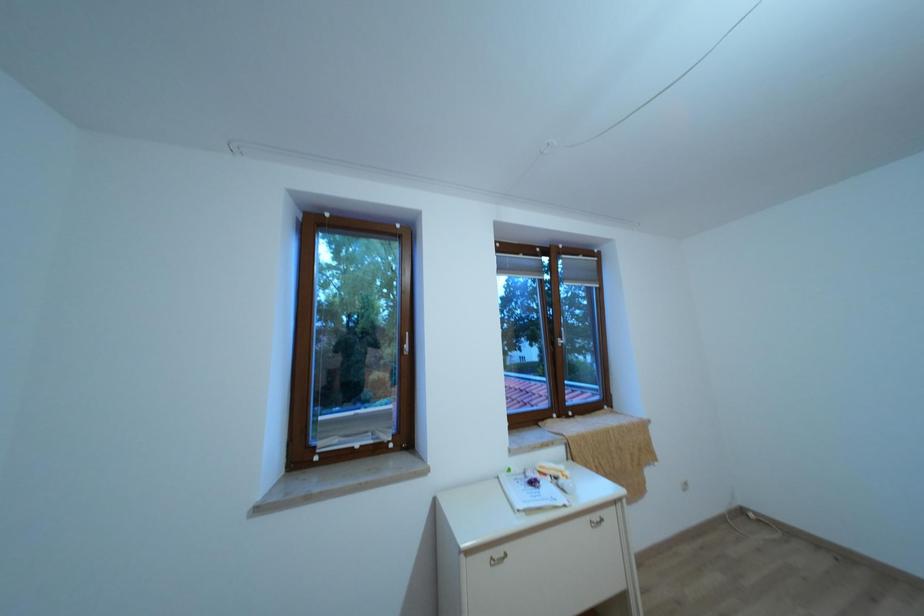
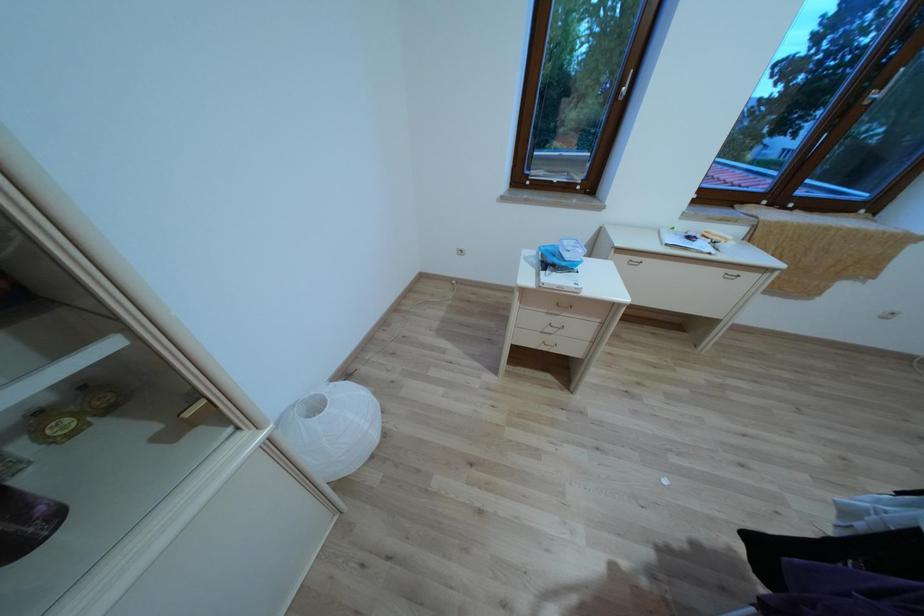
The first image is from the beginning of the video and the second image is from the end. How did the camera likely rotate when shooting the video?

The camera rotated toward left-down.